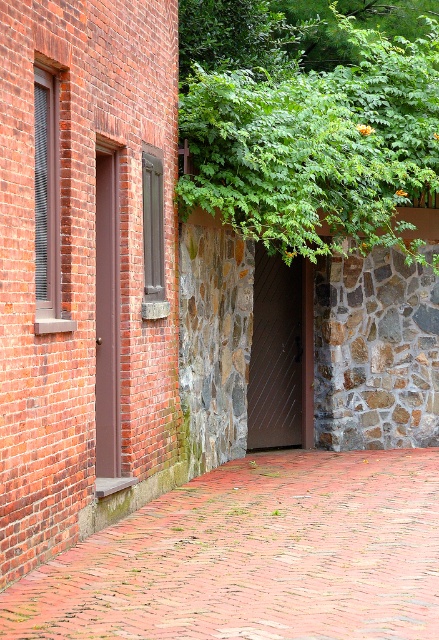
In the scene shown: Can you confirm if brick at center is positioned to the left of brown metal door at center?

Incorrect, brick at center is not on the left side of brown metal door at center.

Does brick at center have a lesser height compared to brown metal door at center?

Yes.

Consider the image. Who is more distant from viewer, (298, 544) or (291, 291)?

Positioned behind is point (291, 291).

The width and height of the screenshot is (439, 640). Find the location of `brick at center`. brick at center is located at coordinates (x=255, y=557).

Is point (123, 616) closer to camera compared to point (118, 227)?

Yes, it is.

Can you confirm if brick at center is wider than brown matte door at left?

Yes, brick at center is wider than brown matte door at left.

The width and height of the screenshot is (439, 640). What are the coordinates of `brick at center` in the screenshot? It's located at (255, 557).

Is brick at center above green leafy tree at upper center?

Actually, brick at center is below green leafy tree at upper center.

The image size is (439, 640). What do you see at coordinates (255, 557) in the screenshot? I see `brick at center` at bounding box center [255, 557].

What do you see at coordinates (255, 557) in the screenshot?
I see `brick at center` at bounding box center [255, 557].

This screenshot has height=640, width=439. In order to click on brick at center in this screenshot , I will do `click(255, 557)`.